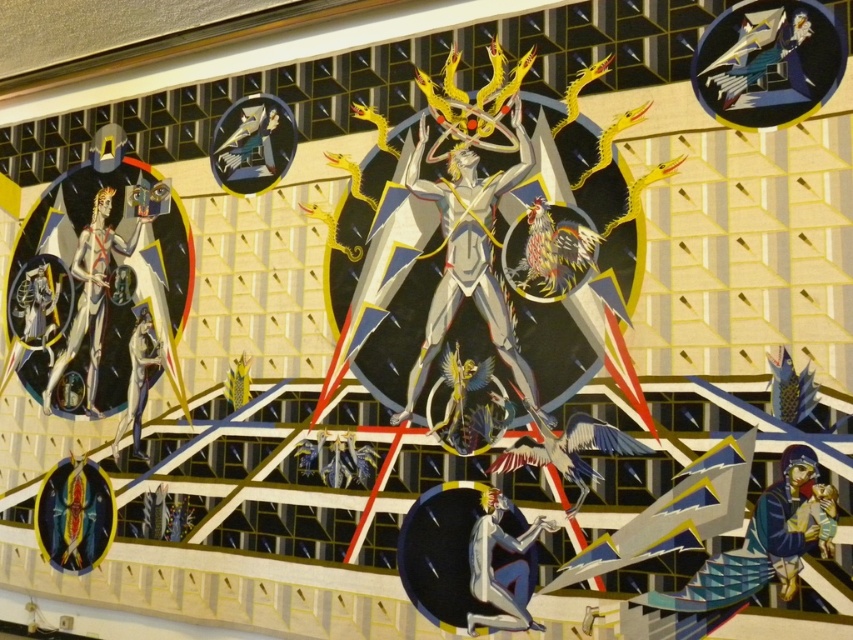
Is metallic silver figure at center shorter than smooth silver figure at lower left?

Incorrect, metallic silver figure at center's height does not fall short of smooth silver figure at lower left's.

Does point (500, 323) lie in front of point (140, 328)?

Yes, point (500, 323) is in front of point (140, 328).

Which is in front, point (495, 305) or point (144, 368)?

Point (495, 305)

Where is `metallic silver figure at center`? metallic silver figure at center is located at coordinates (468, 253).

Is smooth white figure at left taller than smooth white figure at lower center?

Yes.

Image resolution: width=853 pixels, height=640 pixels. What do you see at coordinates (91, 292) in the screenshot?
I see `smooth white figure at left` at bounding box center [91, 292].

The width and height of the screenshot is (853, 640). What are the coordinates of `smooth white figure at left` in the screenshot? It's located at (91, 292).

Locate an element on the screen. smooth white figure at left is located at coordinates (91, 292).

In the scene shown: Is smooth white figure at left bigger than smooth silver figure at lower left?

Indeed, smooth white figure at left has a larger size compared to smooth silver figure at lower left.

Where is `smooth white figure at left`? The height and width of the screenshot is (640, 853). smooth white figure at left is located at coordinates (91, 292).

Find the location of a particular element. The width and height of the screenshot is (853, 640). smooth white figure at left is located at coordinates (91, 292).